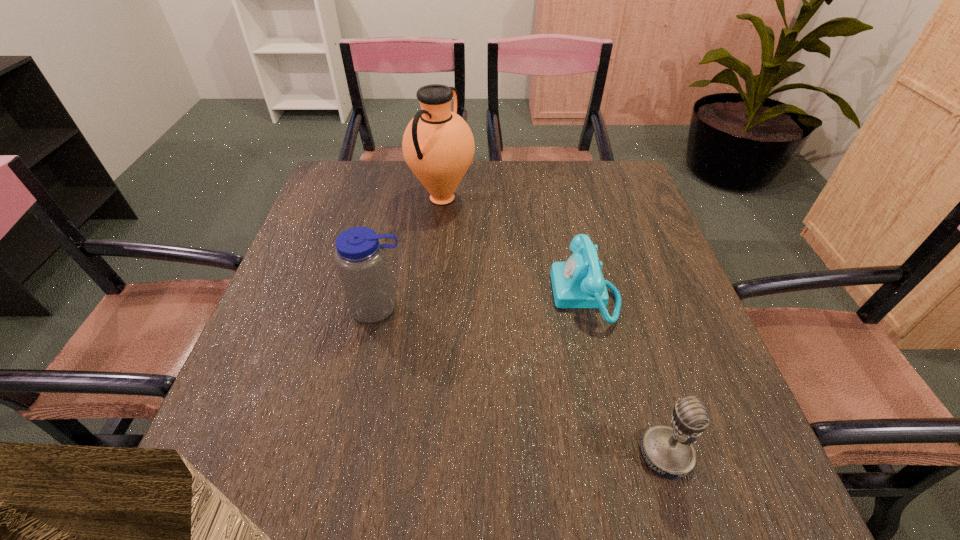
This screenshot has width=960, height=540. Find the location of `vacant region located 0.100m on the front-facing side of the microphone`. vacant region located 0.100m on the front-facing side of the microphone is located at coordinates (580, 454).

Where is `free space located 0.210m on the dial of the shortest object`? This screenshot has height=540, width=960. free space located 0.210m on the dial of the shortest object is located at coordinates (460, 294).

Identify the location of vacant area situated 0.190m on the dial of the shortest object. The height and width of the screenshot is (540, 960). (469, 294).

The width and height of the screenshot is (960, 540). Identify the location of vacant space situated on the dial of the shortest object. (478, 294).

The height and width of the screenshot is (540, 960). Find the location of `object located at the far edge`. object located at the far edge is located at coordinates (438, 145).

In order to click on object that is at the near edge in this screenshot , I will do `click(668, 451)`.

The width and height of the screenshot is (960, 540). Identify the location of microphone that is at the right edge. (668, 451).

The width and height of the screenshot is (960, 540). In order to click on telephone located in the right edge section of the desktop in this screenshot , I will do `click(577, 283)`.

I want to click on object situated at the near right corner, so click(x=668, y=451).

Where is `vacant space at the far edge of the desktop`? The image size is (960, 540). vacant space at the far edge of the desktop is located at coordinates (407, 187).